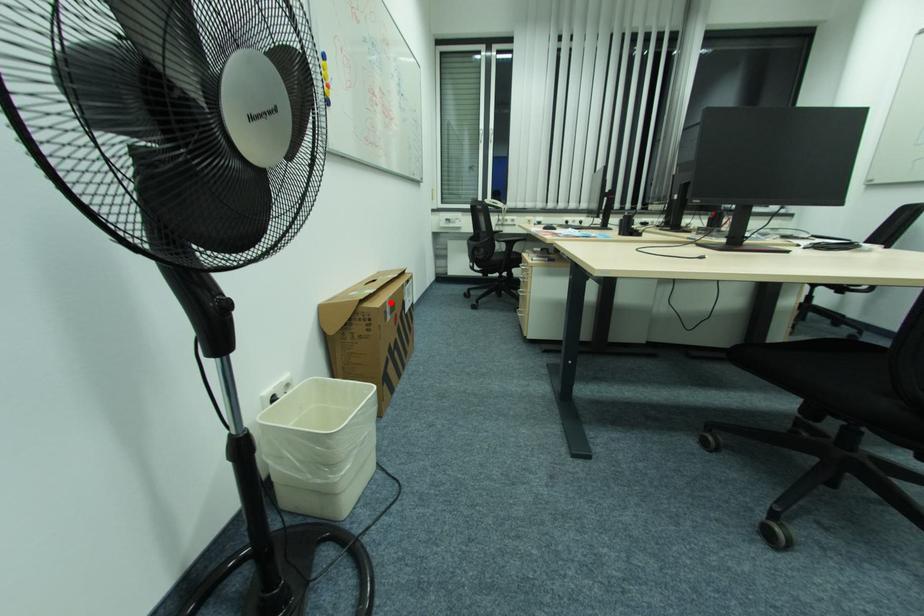
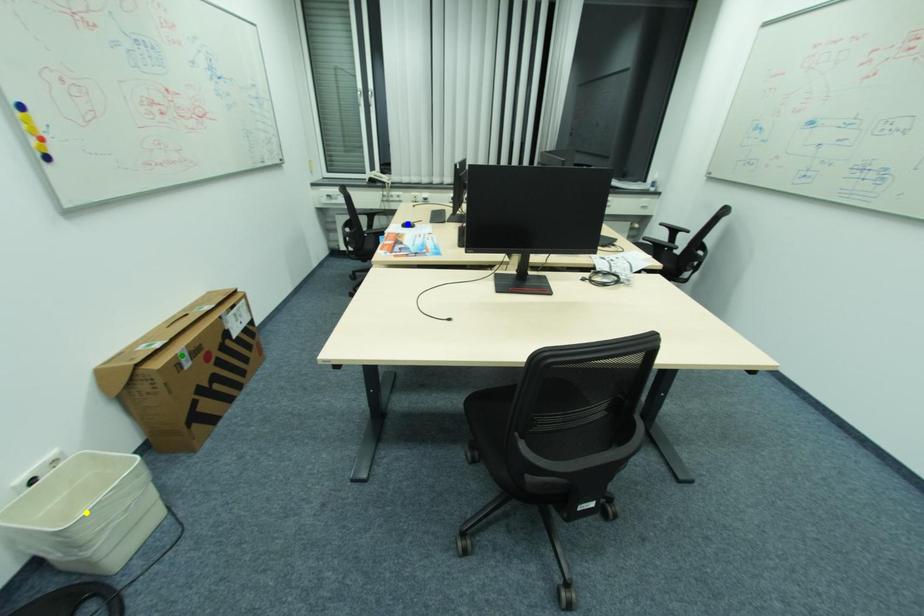
Question: I am providing you with two images of the same scene from different viewpoints. A red point is marked on the first image. You are given multiple points on the second image. Which point in image 2 represents the same 3d spot as the red point in image 1?

Choices:
 (A) green point
 (B) blue point
 (C) yellow point

Answer: (A)